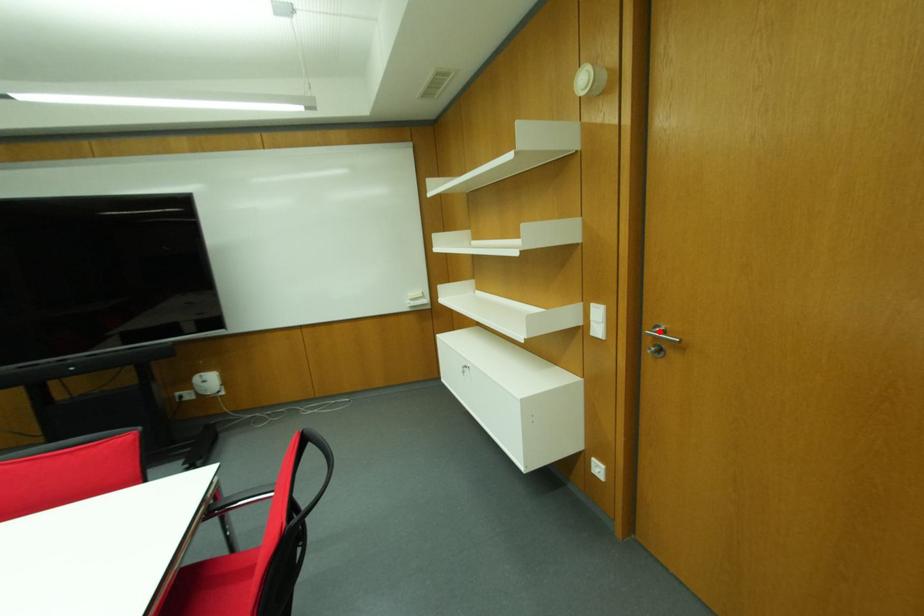
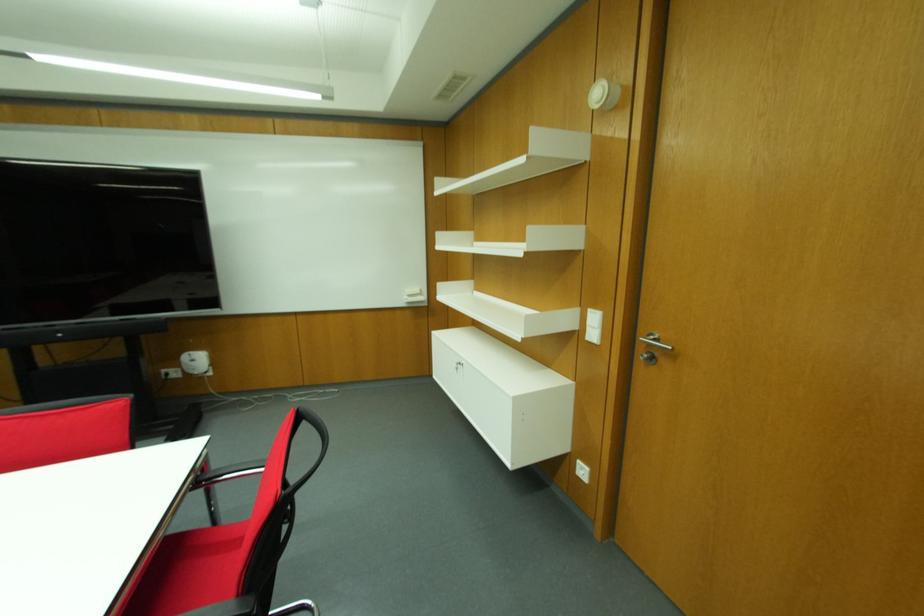
The point at the highlighted location is marked in the first image. Where is the corresponding point in the second image?

(652, 339)